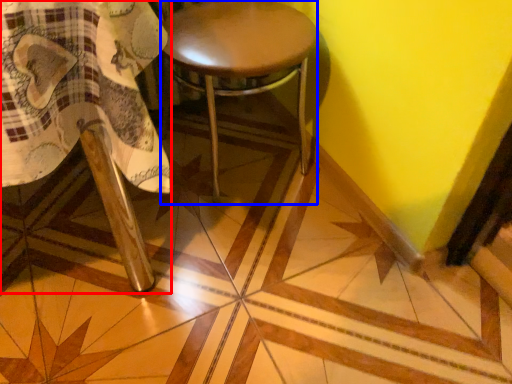
Question: Which point is further to the camera, chair (highlighted by a red box) or stool (highlighted by a blue box)?

Choices:
 (A) chair
 (B) stool

Answer: (B)